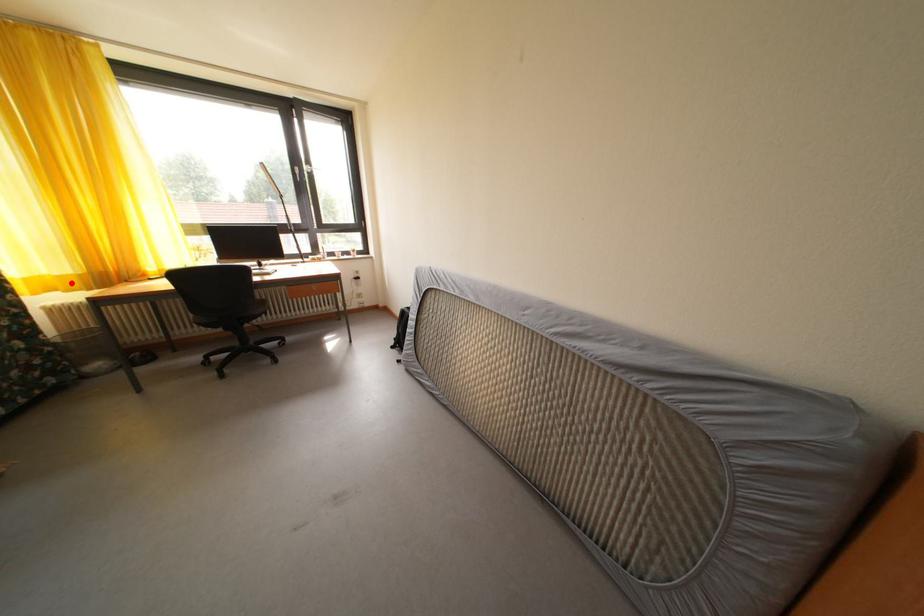
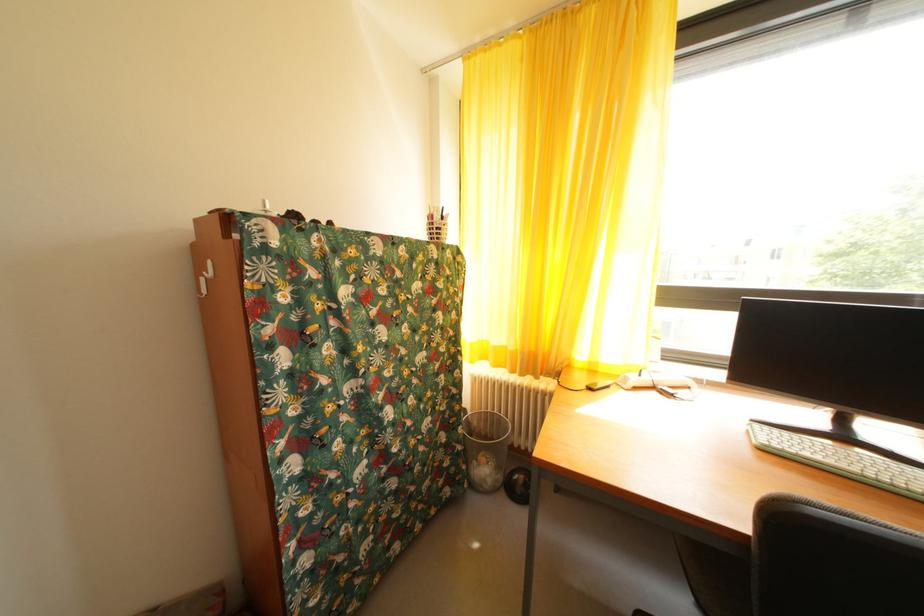
In the second image, find the point that corresponds to the highlighted location in the first image.

(505, 354)